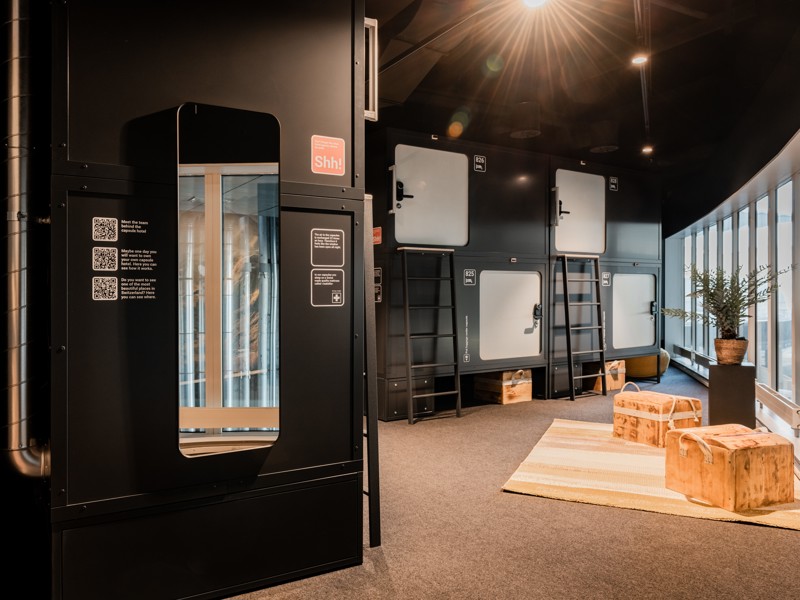
Where is `light`? This screenshot has width=800, height=600. light is located at coordinates (534, 6), (645, 62), (649, 149).